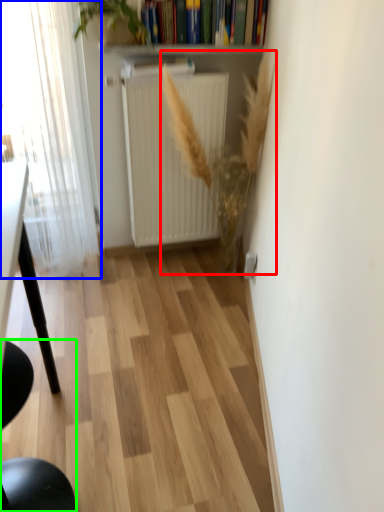
Question: Considering the real-world distances, which object is closest to plant (highlighted by a red box)? window (highlighted by a blue box) or chair (highlighted by a green box).

Choices:
 (A) window
 (B) chair

Answer: (A)